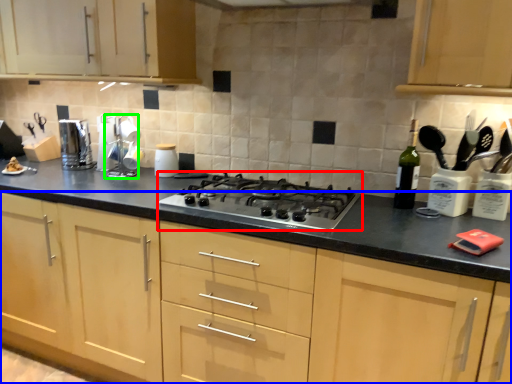
Question: Considering the real-world distances, which object is farthest from gas stove (highlighted by a red box)? cabinetry (highlighted by a blue box) or appliance (highlighted by a green box)?

Choices:
 (A) cabinetry
 (B) appliance

Answer: (B)